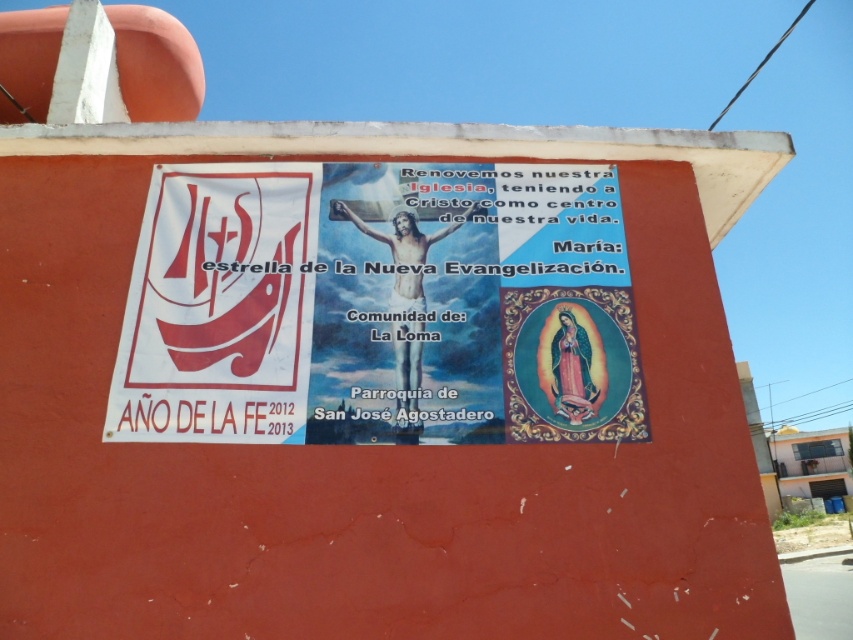
Question: Is white paper poster at upper center to the left of white paper poster at center from the viewer's perspective?

Choices:
 (A) yes
 (B) no

Answer: (A)

Question: Is white paper poster at upper center closer to camera compared to white paper poster at center?

Choices:
 (A) no
 (B) yes

Answer: (B)

Question: Which point appears closest to the camera in this image?

Choices:
 (A) (207, 168)
 (B) (363, 576)

Answer: (B)

Question: Which point is closer to the camera taking this photo?

Choices:
 (A) (103, 328)
 (B) (486, 228)

Answer: (A)

Question: Is white paper poster at upper center to the left of white paper poster at center from the viewer's perspective?

Choices:
 (A) yes
 (B) no

Answer: (A)